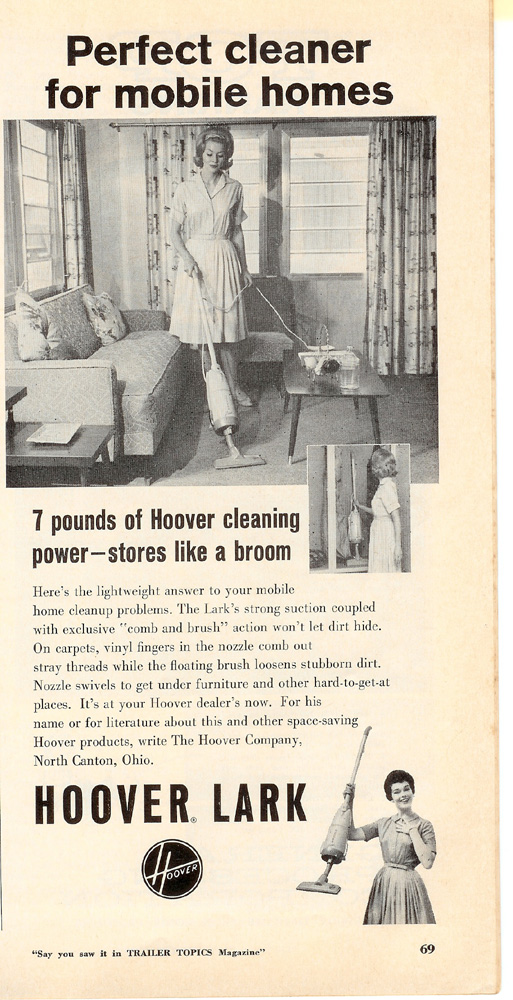
At what (x,y) coordinates should I click in order to perform the action: click on curtains. Please return your answer as a coordinate pair (x, y). The image size is (513, 1000). Looking at the image, I should click on (75, 173), (173, 159), (404, 244).